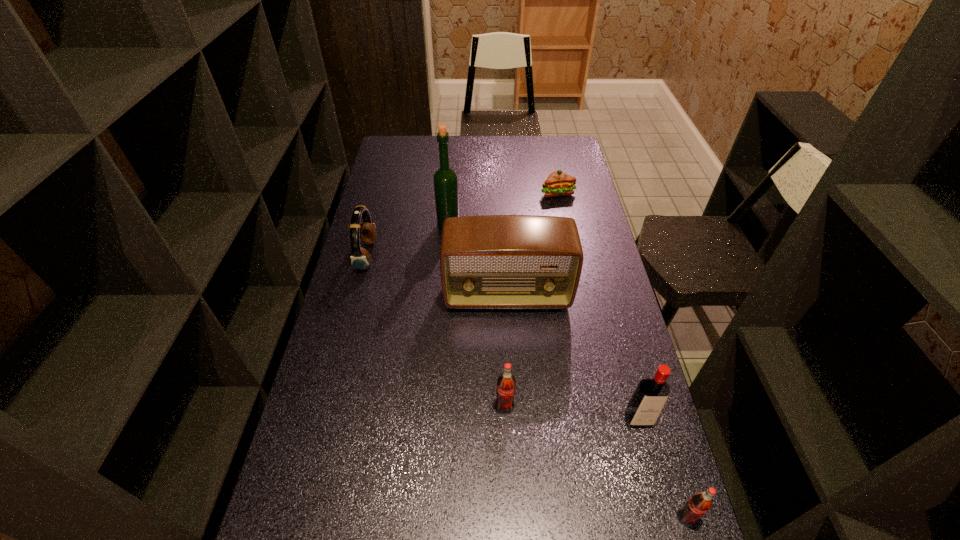
The width and height of the screenshot is (960, 540). Identify the location of free space for a new soda bottle on the left. (372, 327).